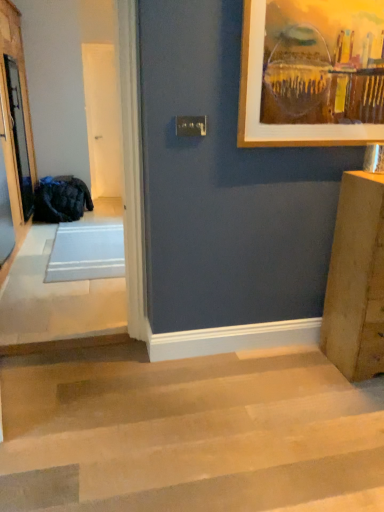
Question: Based on their positions, is dark blue fabric bag at left located to the left or right of white glossy door at center, marked as the first screen door in a right-to-left arrangement?

Choices:
 (A) right
 (B) left

Answer: (B)

Question: Considering their positions, is dark blue fabric bag at left located in front of or behind white glossy door at center, the 2th screen door when ordered from front to back?

Choices:
 (A) behind
 (B) front

Answer: (B)

Question: Estimate the real-world distances between objects in this image. Which object is closer to the light brown wooden stairs at lower left?

Choices:
 (A) white glossy door at center, marked as the 1th screen door in a back-to-front arrangement
 (B) dark blue fabric bag at left
 (C) clear glass screen door at left, positioned as the second screen door in right-to-left order

Answer: (C)

Question: Which object is the farthest from the clear glass screen door at left, which is counted as the second screen door, starting from the back?

Choices:
 (A) light brown wooden stairs at lower left
 (B) white glossy door at center, the 2th screen door when ordered from front to back
 (C) dark blue fabric bag at left

Answer: (A)